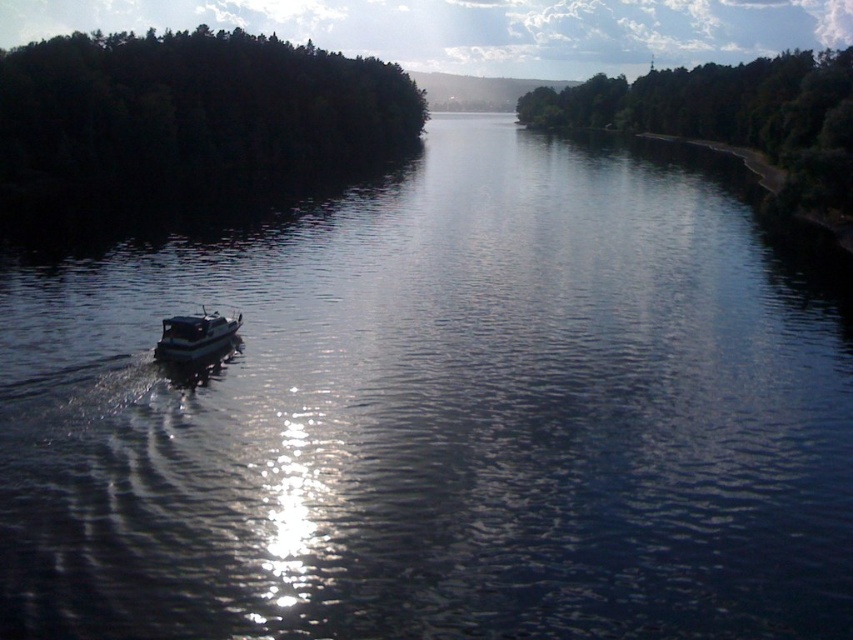
You are a photographer planning to take a wide shot of the dark green forest at upper left and the green leafy trees at right. Which area should you focus on to capture more details since one is wider than the other?

The green leafy trees at right are wider than the dark green forest at upper left, so focusing on them would allow you to capture more details in your wide shot.

You are standing on the riverbank and see the white glossy boat at lower left and the green leafy trees at right. Which object is closer to you?

The green leafy trees at right are closer to you because the white glossy boat at lower left is behind them.

You are standing on the riverbank and see the dark green forest at upper left and the green leafy trees at right. Which of these two features is closer to the water surface?

The dark green forest at upper left is positioned under green leafy trees at right, so the dark green forest at upper left is closer to the water surface.